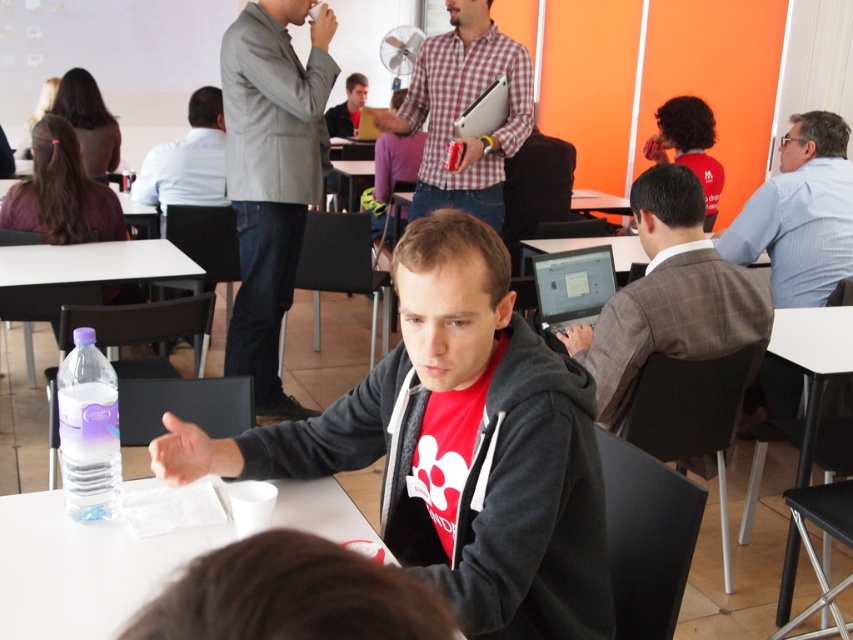
Between light gray blazer at upper left and light blue shirt at upper left, which one has more height?

light gray blazer at upper left is taller.

Looking at this image, can you confirm if light gray blazer at upper left is taller than light blue shirt at upper left?

Yes, light gray blazer at upper left is taller than light blue shirt at upper left.

The image size is (853, 640). What do you see at coordinates (271, 177) in the screenshot? I see `light gray blazer at upper left` at bounding box center [271, 177].

Image resolution: width=853 pixels, height=640 pixels. In order to click on light gray blazer at upper left in this screenshot , I will do `click(271, 177)`.

Can you confirm if white plastic table at lower center is taller than checkered fabric shirt at center?

No, white plastic table at lower center is not taller than checkered fabric shirt at center.

Does white plastic table at lower center have a larger size compared to checkered fabric shirt at center?

Incorrect, white plastic table at lower center is not larger than checkered fabric shirt at center.

Who is more forward, (68, 572) or (518, 58)?

Positioned in front is point (68, 572).

At what (x,y) coordinates should I click in order to perform the action: click on white plastic table at lower center. Please return your answer as a coordinate pair (x, y). This screenshot has width=853, height=640. Looking at the image, I should click on (84, 566).

Between clear plastic bottle at lower left and purple fabric table at left, which one is positioned higher?

purple fabric table at left

Does clear plastic bottle at lower left lie behind purple fabric table at left?

No, clear plastic bottle at lower left is in front of purple fabric table at left.

Describe the element at coordinates (88, 429) in the screenshot. This screenshot has height=640, width=853. I see `clear plastic bottle at lower left` at that location.

You are a GUI agent. You are given a task and a screenshot of the screen. Output one action in this format:
    pyautogui.click(x=<x>, y=<y>)
    Task: Click on the clear plastic bottle at lower left
    This screenshot has height=640, width=853.
    Given the screenshot: What is the action you would take?
    pyautogui.click(x=88, y=429)